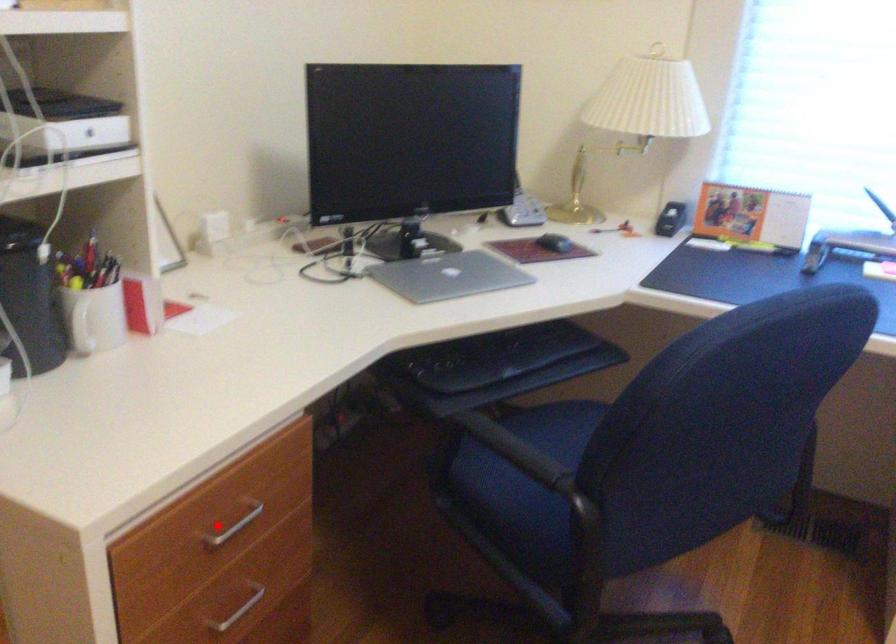
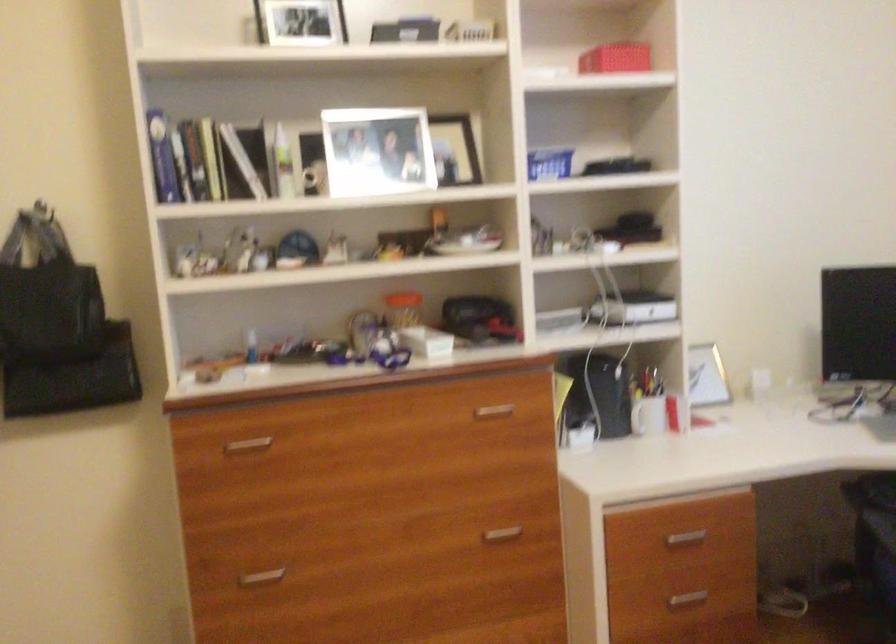
Where in the second image is the point corresponding to the highlighted location from the first image?

(685, 538)